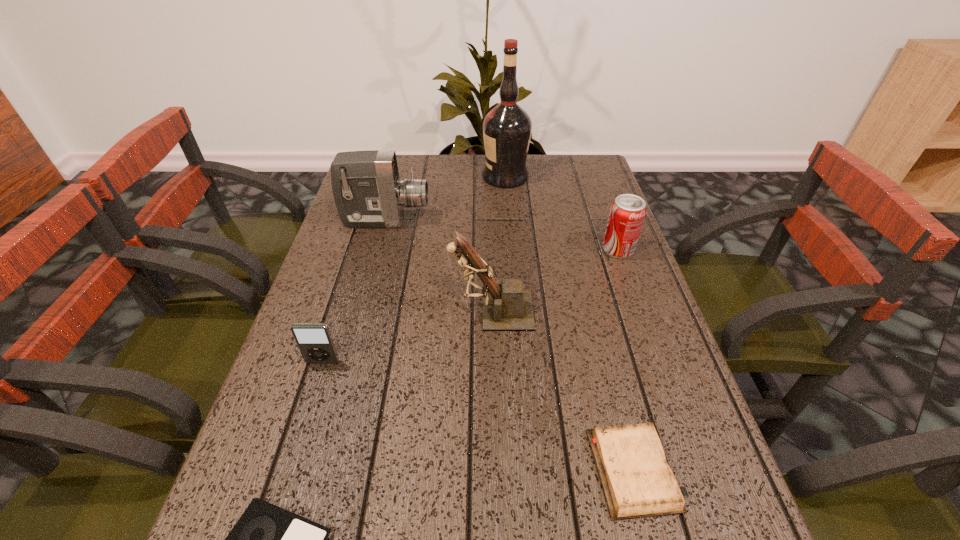
Locate an element on the screen. Image resolution: width=960 pixels, height=540 pixels. free location that satisfies the following two spatial constraints: 1. on the front-facing side of the second shortest object; 2. on the left side of the farther iPod is located at coordinates (289, 470).

I want to click on vacant space that satisfies the following two spatial constraints: 1. on the front-facing side of the figurine; 2. on the front-facing side of the taller iPod, so click(493, 362).